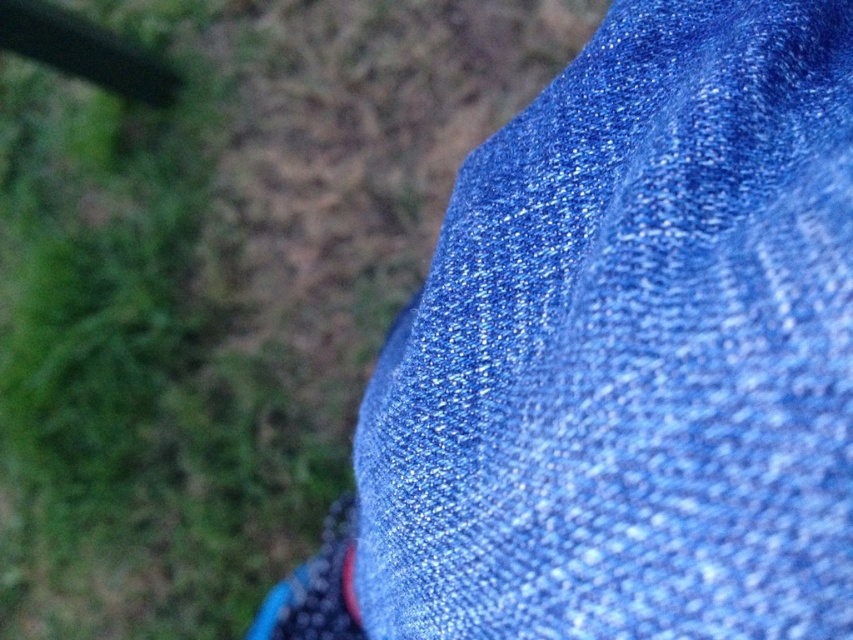
Is blue textured fabric at upper right thinner than blue glittery fabric at upper right?

Indeed, blue textured fabric at upper right has a lesser width compared to blue glittery fabric at upper right.

In order to click on blue textured fabric at upper right in this screenshot , I will do `click(631, 349)`.

You are a GUI agent. You are given a task and a screenshot of the screen. Output one action in this format:
    pyautogui.click(x=<x>, y=<y>)
    Task: Click on the blue textured fabric at upper right
    The image size is (853, 640).
    Given the screenshot: What is the action you would take?
    (631, 349)